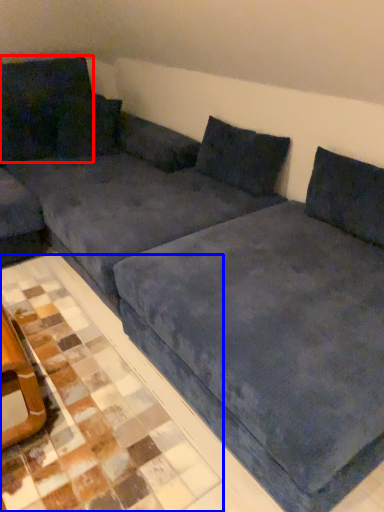
Question: Which object is closer to the camera taking this photo, pillow (highlighted by a red box) or tile (highlighted by a blue box)?

Choices:
 (A) pillow
 (B) tile

Answer: (B)